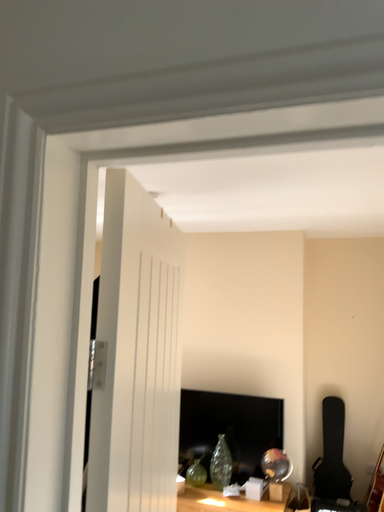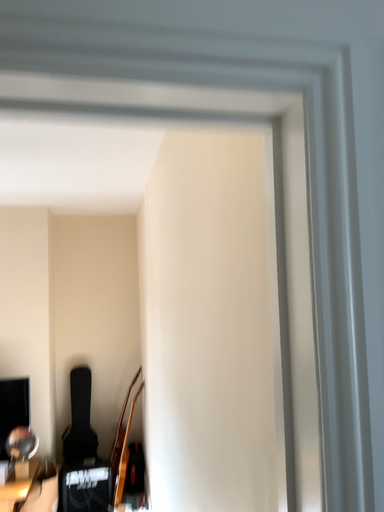
Question: How did the camera likely rotate when shooting the video?

Choices:
 (A) rotated left
 (B) rotated right

Answer: (B)